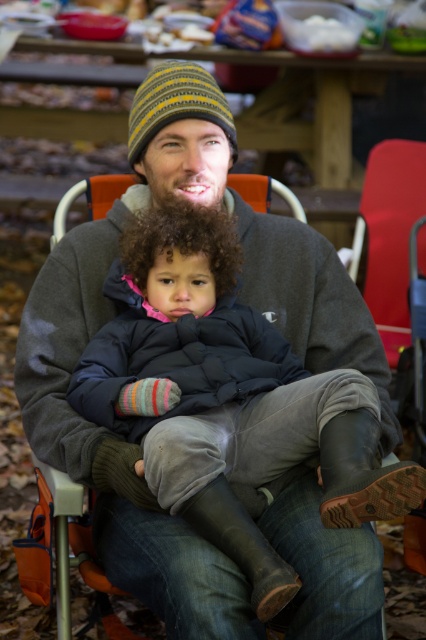
Is red plastic chair at right bigger than yellow striped knit beanie at center?

Indeed, red plastic chair at right has a larger size compared to yellow striped knit beanie at center.

Is point (385, 221) positioned behind point (198, 97)?

Yes.

Find the location of a particular element. red plastic chair at right is located at coordinates (389, 234).

Where is `red plastic chair at right`? The height and width of the screenshot is (640, 426). red plastic chair at right is located at coordinates pyautogui.click(x=389, y=234).